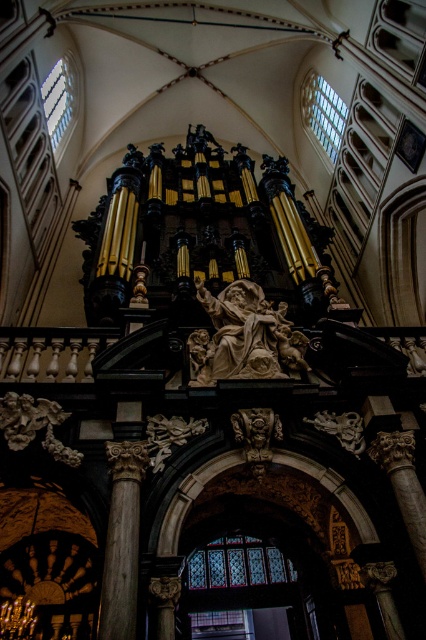
You are an architect inspecting the cathedral. You notice the white marble statue at center and the wooden column at center. Which object is positioned higher in the cathedral?

The white marble statue at center is above the wooden column at center, so it is positioned higher in the cathedral.

You are an architect visiting the cathedral and notice the white marble statue at center and the wooden column at center. Which object is located to the right of the other?

The white marble statue at center is positioned on the right side of wooden column at center.

Consider the image. You are an architect planning to place a new sculpture in the cathedral. You see the white marble statue at center and the wooden column at center. Which object is wider? Please choose between the two.

The white marble statue at center is wider than the wooden column at center according to the description.